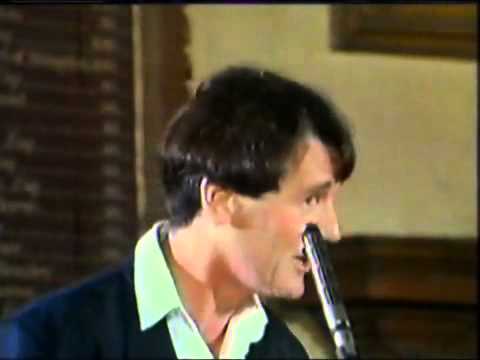
Where is `stand`? The width and height of the screenshot is (480, 360). stand is located at coordinates (343, 349).